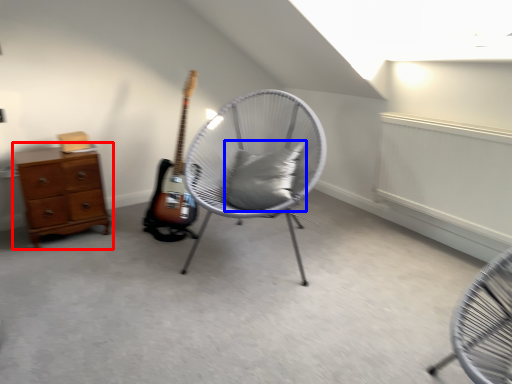
Question: Which point is closer to the camera, chest of drawers (highlighted by a red box) or pillow (highlighted by a blue box)?

Choices:
 (A) chest of drawers
 (B) pillow

Answer: (B)